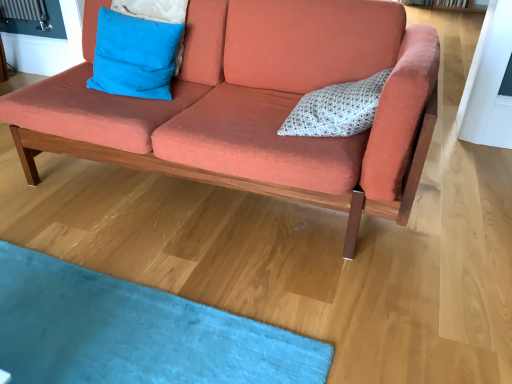
Question: From a real-world perspective, is coral fabric couch at center on top of white dotted fabric pillow at center, acting as the 2th pillow starting from the left?

Choices:
 (A) no
 (B) yes

Answer: (A)

Question: From the image's perspective, is coral fabric couch at center on top of white dotted fabric pillow at center, acting as the 2th pillow starting from the left?

Choices:
 (A) yes
 (B) no

Answer: (A)

Question: Are coral fabric couch at center and white dotted fabric pillow at center, acting as the 2th pillow starting from the left, far apart?

Choices:
 (A) no
 (B) yes

Answer: (A)

Question: Is white dotted fabric pillow at center, acting as the 2th pillow starting from the left, located within coral fabric couch at center?

Choices:
 (A) no
 (B) yes

Answer: (B)

Question: Considering the relative sizes of coral fabric couch at center and white dotted fabric pillow at center, which ranks as the 1th pillow in right-to-left order, in the image provided, is coral fabric couch at center shorter than white dotted fabric pillow at center, which ranks as the 1th pillow in right-to-left order,?

Choices:
 (A) no
 (B) yes

Answer: (A)

Question: Is coral fabric couch at center directly adjacent to white dotted fabric pillow at center, acting as the 2th pillow starting from the left?

Choices:
 (A) yes
 (B) no

Answer: (B)

Question: From the image's perspective, does blue suede pillow at upper left, which ranks as the second pillow in right-to-left order, appear lower than coral fabric couch at center?

Choices:
 (A) yes
 (B) no

Answer: (B)

Question: Is blue suede pillow at upper left, the 1th pillow from the left, not close to coral fabric couch at center?

Choices:
 (A) yes
 (B) no

Answer: (B)

Question: Can you confirm if blue suede pillow at upper left, the 1th pillow from the left, is shorter than coral fabric couch at center?

Choices:
 (A) no
 (B) yes

Answer: (B)

Question: From a real-world perspective, does blue suede pillow at upper left, the 1th pillow from the left, stand above coral fabric couch at center?

Choices:
 (A) yes
 (B) no

Answer: (A)

Question: Is coral fabric couch at center at the back of blue suede pillow at upper left, which ranks as the second pillow in right-to-left order?

Choices:
 (A) yes
 (B) no

Answer: (A)

Question: Is blue suede pillow at upper left, which ranks as the second pillow in right-to-left order, wider than coral fabric couch at center?

Choices:
 (A) no
 (B) yes

Answer: (A)

Question: Is coral fabric couch at center positioned beyond the bounds of blue suede pillow at upper left, which ranks as the second pillow in right-to-left order?

Choices:
 (A) no
 (B) yes

Answer: (B)